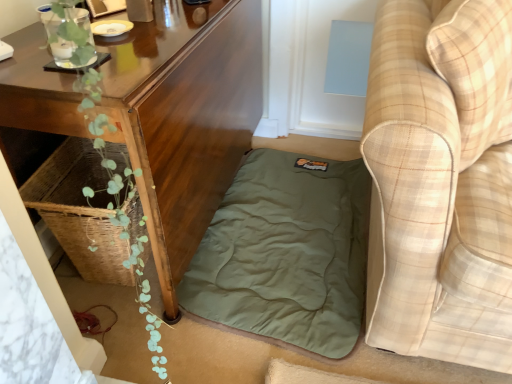
Question: Would you say olive green fabric mattress at lower center is to the left or to the right of beige plaid fabric couch at lower right in the picture?

Choices:
 (A) right
 (B) left

Answer: (B)

Question: Is olive green fabric mattress at lower center in front of or behind beige plaid fabric couch at lower right in the image?

Choices:
 (A) front
 (B) behind

Answer: (B)

Question: Which object is the closest to the beige plaid fabric couch at lower right?

Choices:
 (A) olive green fabric mattress at lower center
 (B) wooden table at lower left

Answer: (A)

Question: Estimate the real-world distances between objects in this image. Which object is farther from the beige plaid fabric couch at lower right?

Choices:
 (A) wooden table at lower left
 (B) olive green fabric mattress at lower center

Answer: (A)